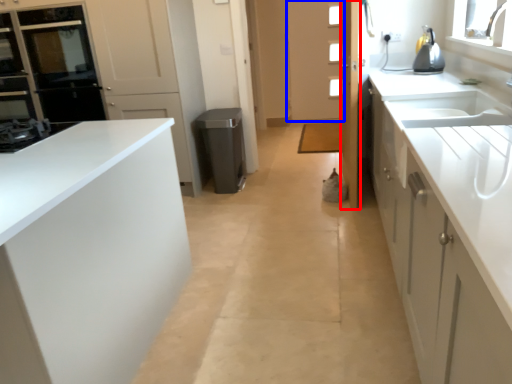
Question: Which of the following is the closest to the observer, door (highlighted by a red box) or door (highlighted by a blue box)?

Choices:
 (A) door
 (B) door

Answer: (A)